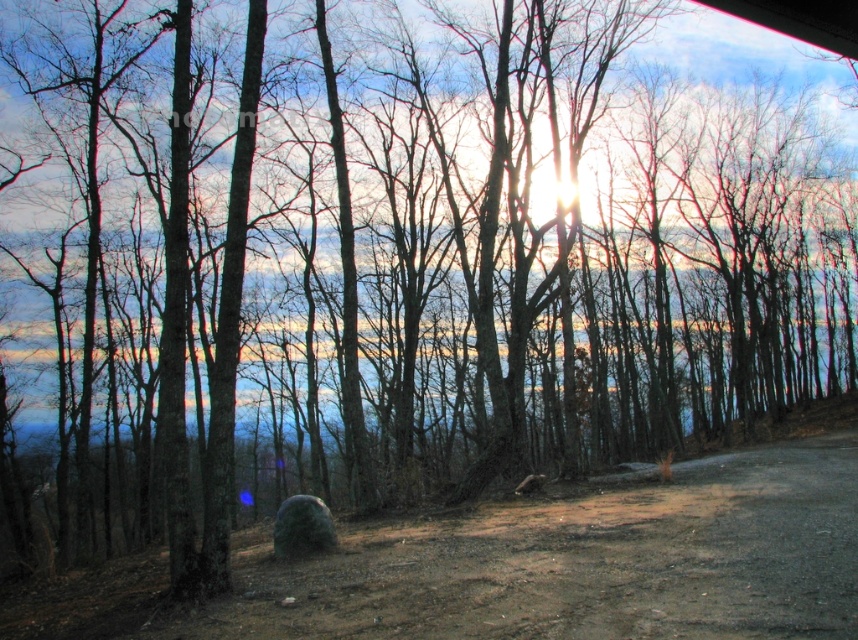
Question: Which of the following is the farthest from the observer?

Choices:
 (A) (124, 595)
 (B) (328, 513)

Answer: (B)

Question: Does dull brown dirt track at lower right appear on the left side of green mossy boulder at center?

Choices:
 (A) yes
 (B) no

Answer: (B)

Question: Does dull brown dirt track at lower right have a greater width compared to green mossy boulder at center?

Choices:
 (A) no
 (B) yes

Answer: (B)

Question: Can you confirm if dull brown dirt track at lower right is thinner than green mossy boulder at center?

Choices:
 (A) no
 (B) yes

Answer: (A)